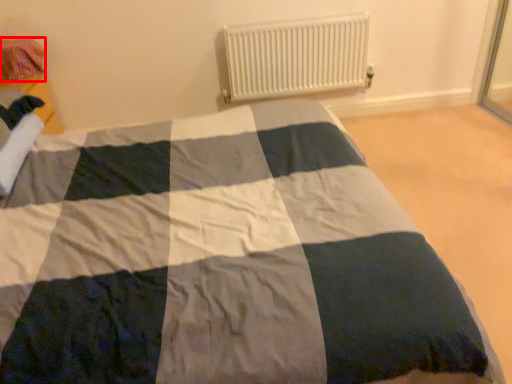
Question: From the image, what is the correct spatial relationship of material (annotated by the red box) in relation to radiator?

Choices:
 (A) left
 (B) right

Answer: (A)